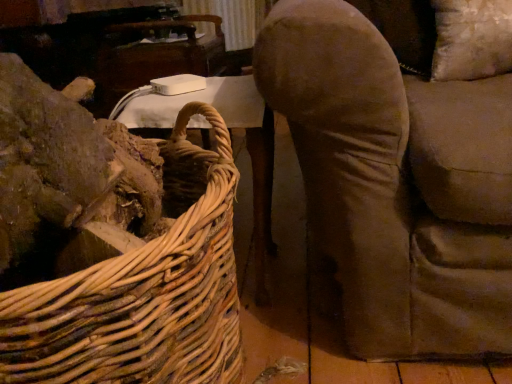
Question: Can you confirm if white plastic table at upper left, arranged as the 2th table when viewed from the top, is thinner than woven natural wood picnic basket at left?

Choices:
 (A) yes
 (B) no

Answer: (A)

Question: Is white plastic table at upper left, the 1th table when ordered from bottom to top, bigger than woven natural wood picnic basket at left?

Choices:
 (A) no
 (B) yes

Answer: (A)

Question: Is white plastic table at upper left, the 1th table when ordered from bottom to top, behind woven natural wood picnic basket at left?

Choices:
 (A) no
 (B) yes

Answer: (B)

Question: Is the position of white plastic table at upper left, positioned as the 1th table in front-to-back order, less distant than that of woven natural wood picnic basket at left?

Choices:
 (A) yes
 (B) no

Answer: (B)

Question: Does white plastic table at upper left, arranged as the 2th table when viewed from the top, have a smaller size compared to woven natural wood picnic basket at left?

Choices:
 (A) yes
 (B) no

Answer: (A)

Question: In terms of height, does white plastic table at upper center, positioned as the first table in back-to-front order, look taller or shorter compared to white plastic table at upper left, which ranks as the second table in back-to-front order?

Choices:
 (A) tall
 (B) short

Answer: (B)

Question: Considering the positions of white plastic table at upper center, positioned as the first table in back-to-front order, and white plastic table at upper left, positioned as the 1th table in front-to-back order, in the image, is white plastic table at upper center, positioned as the first table in back-to-front order, bigger or smaller than white plastic table at upper left, positioned as the 1th table in front-to-back order,?

Choices:
 (A) big
 (B) small

Answer: (A)

Question: Do you think white plastic table at upper center, positioned as the first table in back-to-front order, is within white plastic table at upper left, the 1th table when ordered from bottom to top, or outside of it?

Choices:
 (A) outside
 (B) inside

Answer: (A)

Question: Is white plastic table at upper center, positioned as the first table in back-to-front order, in front of or behind white plastic table at upper left, arranged as the 2th table when viewed from the top, in the image?

Choices:
 (A) behind
 (B) front

Answer: (A)

Question: In terms of size, does white plastic table at upper left, arranged as the 2th table when viewed from the top, appear bigger or smaller than woven natural wood picnic basket at left?

Choices:
 (A) big
 (B) small

Answer: (B)

Question: From a real-world perspective, is white plastic table at upper left, the 1th table when ordered from bottom to top, positioned above or below woven natural wood picnic basket at left?

Choices:
 (A) below
 (B) above

Answer: (A)

Question: In terms of width, does white plastic table at upper left, which ranks as the second table in back-to-front order, look wider or thinner when compared to woven natural wood picnic basket at left?

Choices:
 (A) thin
 (B) wide

Answer: (A)

Question: Considering the positions of white plastic table at upper left, arranged as the 2th table when viewed from the top, and woven natural wood picnic basket at left in the image, is white plastic table at upper left, arranged as the 2th table when viewed from the top, taller or shorter than woven natural wood picnic basket at left?

Choices:
 (A) short
 (B) tall

Answer: (A)

Question: Relative to white plastic table at upper left, positioned as the 1th table in front-to-back order, is woven natural wood picnic basket at left in front or behind?

Choices:
 (A) front
 (B) behind

Answer: (A)

Question: Considering the positions of woven natural wood picnic basket at left and white plastic table at upper left, positioned as the 1th table in front-to-back order, in the image, is woven natural wood picnic basket at left wider or thinner than white plastic table at upper left, positioned as the 1th table in front-to-back order,?

Choices:
 (A) thin
 (B) wide

Answer: (B)